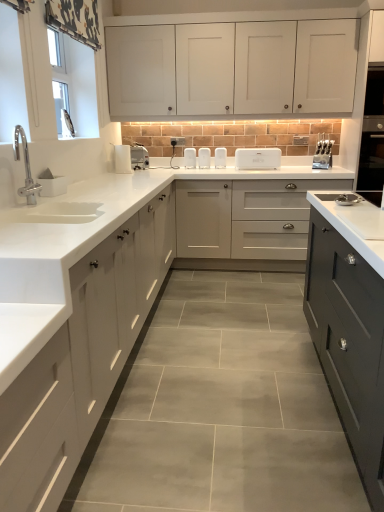
Question: Can you confirm if white matte soap dish at left, the first appliance positioned from the left, is bigger than satin silver knife block at right, marked as the 1th appliance in a right-to-left arrangement?

Choices:
 (A) yes
 (B) no

Answer: (B)

Question: Are white matte soap dish at left, which is counted as the 1th appliance, starting from the front, and satin silver knife block at right, placed as the 6th appliance when sorted from back to front, located far from each other?

Choices:
 (A) no
 (B) yes

Answer: (B)

Question: Is white matte soap dish at left, which is counted as the 1th appliance, starting from the front, beside satin silver knife block at right, positioned as the third appliance in front-to-back order?

Choices:
 (A) no
 (B) yes

Answer: (A)

Question: From the image's perspective, is white matte soap dish at left, acting as the eighth appliance starting from the right, above satin silver knife block at right, positioned as the third appliance in front-to-back order?

Choices:
 (A) no
 (B) yes

Answer: (A)

Question: Can you confirm if white matte soap dish at left, the first appliance positioned from the left, is smaller than satin silver knife block at right, marked as the 1th appliance in a right-to-left arrangement?

Choices:
 (A) no
 (B) yes

Answer: (B)

Question: From a real-world perspective, is matte gray cabinet at center, marked as the 2th cabinetry in a bottom-to-top arrangement, physically located above or below white plastic toaster at center, positioned as the 4th appliance in back-to-front order?

Choices:
 (A) above
 (B) below

Answer: (B)

Question: Is matte gray cabinet at center, the 2th cabinetry positioned from the top, spatially inside white plastic toaster at center, marked as the seventh appliance in a left-to-right arrangement, or outside of it?

Choices:
 (A) inside
 (B) outside

Answer: (B)

Question: In terms of size, does matte gray cabinet at center, the 2th cabinetry positioned from the top, appear bigger or smaller than white plastic toaster at center, which ranks as the 5th appliance in front-to-back order?

Choices:
 (A) small
 (B) big

Answer: (B)

Question: Considering the positions of matte gray cabinet at center, marked as the 2th cabinetry in a bottom-to-top arrangement, and white plastic toaster at center, marked as the seventh appliance in a left-to-right arrangement, in the image, is matte gray cabinet at center, marked as the 2th cabinetry in a bottom-to-top arrangement, wider or thinner than white plastic toaster at center, marked as the seventh appliance in a left-to-right arrangement,?

Choices:
 (A) thin
 (B) wide

Answer: (B)

Question: Which is correct: white plastic toaster at upper center, the seventh appliance in the back-to-front sequence, is inside matte gray cabinet at center, marked as the 2th cabinetry in a bottom-to-top arrangement, or outside of it?

Choices:
 (A) inside
 (B) outside

Answer: (B)

Question: In the image, is white plastic toaster at upper center, which is the 7th appliance in right-to-left order, on the left side or the right side of matte gray cabinet at center, the 2th cabinetry positioned from the top?

Choices:
 (A) right
 (B) left

Answer: (B)

Question: Is white plastic toaster at upper center, the seventh appliance in the back-to-front sequence, wider or thinner than matte gray cabinet at center, marked as the 2th cabinetry in a bottom-to-top arrangement?

Choices:
 (A) wide
 (B) thin

Answer: (B)

Question: Considering their positions, is white plastic toaster at upper center, which appears as the 2th appliance when viewed from the front, located in front of or behind matte gray cabinet at center, marked as the 2th cabinetry in a bottom-to-top arrangement?

Choices:
 (A) front
 (B) behind

Answer: (B)

Question: Is white glossy countertop at center taller or shorter than white matte cabinet at left, arranged as the first cabinetry when ordered from the bottom?

Choices:
 (A) tall
 (B) short

Answer: (A)

Question: From the image's perspective, relative to white matte cabinet at left, arranged as the third cabinetry when viewed from the top, is white glossy countertop at center above or below?

Choices:
 (A) above
 (B) below

Answer: (B)